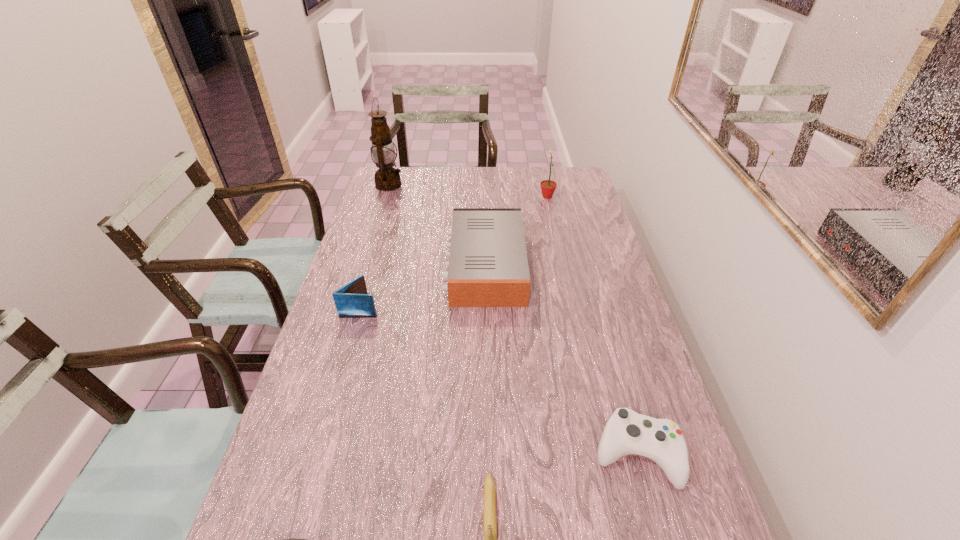
The image size is (960, 540). I want to click on free space located on the control panel of the radio receiver, so click(361, 265).

The image size is (960, 540). I want to click on blank area located 0.110m on the control panel of the radio receiver, so click(x=413, y=265).

Locate an element on the screen. free space located 0.150m on the exterior surface of the wallet is located at coordinates (430, 307).

Identify the location of vacant position located on the left of the farther control. This screenshot has width=960, height=540. (536, 453).

Find the location of a particular element. oil lamp located in the far edge section of the desktop is located at coordinates (387, 178).

Identify the location of sunflower located in the far edge section of the desktop. Image resolution: width=960 pixels, height=540 pixels. (548, 187).

You are a GUI agent. You are given a task and a screenshot of the screen. Output one action in this format:
    pyautogui.click(x=<x>, y=<y>)
    Task: Click on the oil lamp at the left edge
    The image size is (960, 540).
    Given the screenshot: What is the action you would take?
    pos(387,178)

Image resolution: width=960 pixels, height=540 pixels. Find the location of `wallet at the left edge`. wallet at the left edge is located at coordinates (352, 300).

Where is `sunflower that is at the right edge`? sunflower that is at the right edge is located at coordinates (548, 187).

Find the location of a particular element. control that is at the right edge is located at coordinates (626, 433).